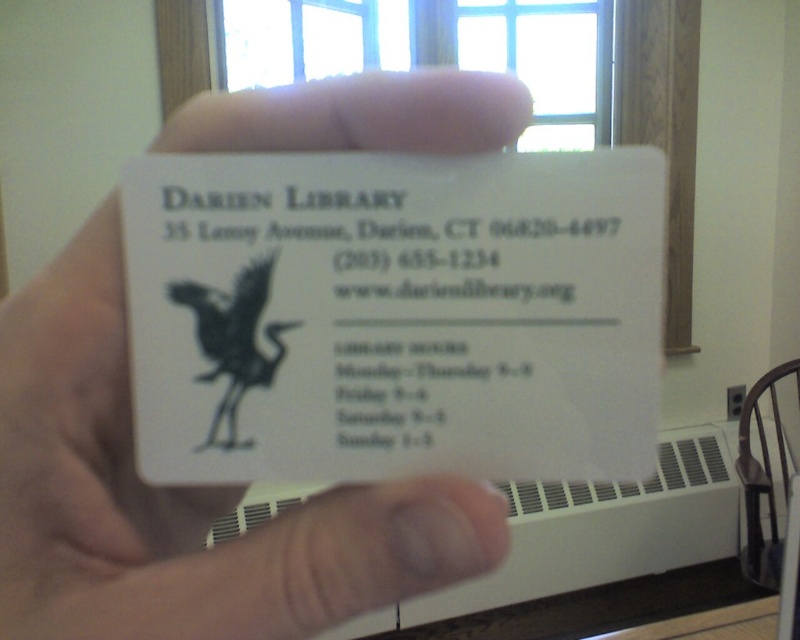
Is white paper card at center taller than white matte card at center?

No.

Who is shorter, white paper card at center or white matte card at center?

white paper card at center is shorter.

Who is more forward, (x=260, y=376) or (x=456, y=506)?

Point (x=456, y=506)

This screenshot has width=800, height=640. Find the location of `white paper card at center`. white paper card at center is located at coordinates (396, 316).

The height and width of the screenshot is (640, 800). What do you see at coordinates (396, 316) in the screenshot? I see `white paper card at center` at bounding box center [396, 316].

In the scene shown: Which is below, white paper card at center or black matte bird at center?

black matte bird at center is below.

Is point (654, 192) farther from viewer compared to point (256, 353)?

No, it is in front of (256, 353).

The width and height of the screenshot is (800, 640). I want to click on white paper card at center, so click(396, 316).

Is point (44, 536) positioned in front of point (249, 275)?

That is True.

At what (x,y) coordinates should I click in order to perform the action: click on white matte card at center. Please return your answer as a coordinate pair (x, y). Image resolution: width=800 pixels, height=640 pixels. Looking at the image, I should click on (180, 499).

Between point (228, 598) and point (256, 285), which one is positioned behind?

The point (256, 285) is more distant.

Identify the location of white matte card at center. (180, 499).